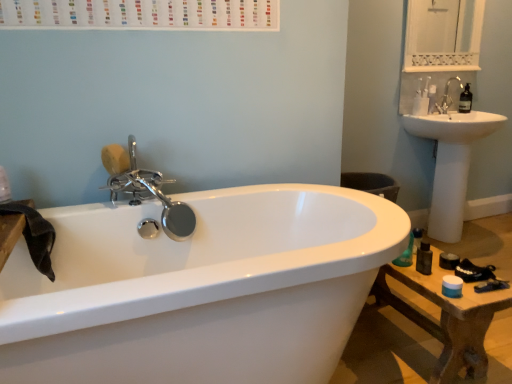
Question: Should I look upward or downward to see wooden table at lower right?

Choices:
 (A) up
 (B) down

Answer: (B)

Question: Is wooden table at lower right shorter than polished chrome faucet at upper left, arranged as the first tap when viewed from the front?

Choices:
 (A) no
 (B) yes

Answer: (B)

Question: Does wooden table at lower right touch polished chrome faucet at upper left, the first tap from the left?

Choices:
 (A) yes
 (B) no

Answer: (B)

Question: Does wooden table at lower right appear on the right side of polished chrome faucet at upper left, which is the 2th tap from right to left?

Choices:
 (A) no
 (B) yes

Answer: (B)

Question: Is the depth of wooden table at lower right greater than that of polished chrome faucet at upper left, arranged as the first tap when viewed from the front?

Choices:
 (A) yes
 (B) no

Answer: (B)

Question: From the image's perspective, is wooden table at lower right under polished chrome faucet at upper left, which is the second tap in back-to-front order?

Choices:
 (A) no
 (B) yes

Answer: (B)

Question: Does wooden table at lower right have a smaller size compared to polished chrome faucet at upper left, which is the second tap in back-to-front order?

Choices:
 (A) no
 (B) yes

Answer: (A)

Question: Considering the relative sizes of satin nickel faucet at upper right, marked as the 1th tap in a back-to-front arrangement, and polished chrome faucet at upper left, the first tap from the left, in the image provided, is satin nickel faucet at upper right, marked as the 1th tap in a back-to-front arrangement, taller than polished chrome faucet at upper left, the first tap from the left,?

Choices:
 (A) no
 (B) yes

Answer: (A)

Question: Considering the relative sizes of satin nickel faucet at upper right, acting as the first tap starting from the right, and polished chrome faucet at upper left, which is the 2th tap from right to left, in the image provided, is satin nickel faucet at upper right, acting as the first tap starting from the right, smaller than polished chrome faucet at upper left, which is the 2th tap from right to left,?

Choices:
 (A) no
 (B) yes

Answer: (B)

Question: Is satin nickel faucet at upper right, marked as the first tap in a top-to-bottom arrangement, wider than polished chrome faucet at upper left, the second tap from the top?

Choices:
 (A) yes
 (B) no

Answer: (B)

Question: Can you confirm if satin nickel faucet at upper right, marked as the 1th tap in a back-to-front arrangement, is thinner than polished chrome faucet at upper left, which is the second tap in back-to-front order?

Choices:
 (A) yes
 (B) no

Answer: (A)

Question: Does satin nickel faucet at upper right, acting as the first tap starting from the right, have a lesser height compared to polished chrome faucet at upper left, which ranks as the first tap in bottom-to-top order?

Choices:
 (A) no
 (B) yes

Answer: (B)

Question: Is satin nickel faucet at upper right, which appears as the second tap when ordered from the bottom, next to polished chrome faucet at upper left, which ranks as the first tap in bottom-to-top order?

Choices:
 (A) yes
 (B) no

Answer: (B)

Question: Considering the relative sizes of polished chrome faucet at upper left, which is the second tap in back-to-front order, and white matte toilet paper at upper right in the image provided, is polished chrome faucet at upper left, which is the second tap in back-to-front order, wider than white matte toilet paper at upper right?

Choices:
 (A) no
 (B) yes

Answer: (B)